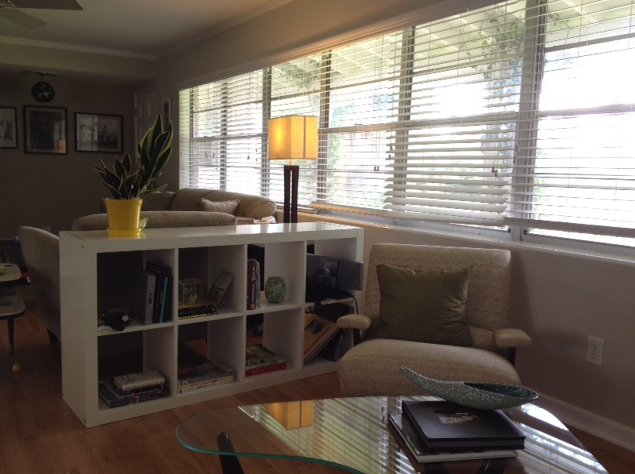
This screenshot has height=474, width=635. I want to click on plant, so click(x=123, y=183).